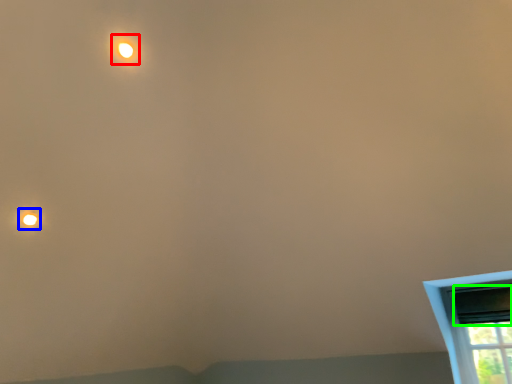
Question: Based on their relative distances, which object is nearer to light (highlighted by a red box)? Choose from droplight (highlighted by a blue box) and window screen (highlighted by a green box).

Choices:
 (A) droplight
 (B) window screen

Answer: (A)